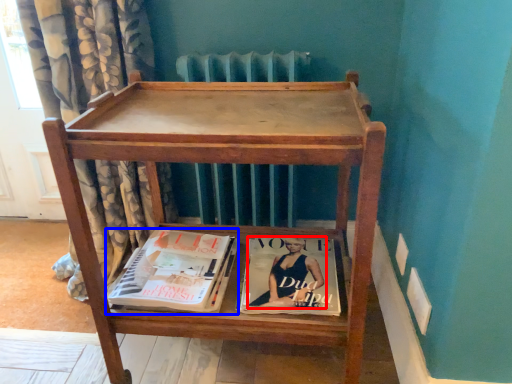
Question: Which point is further to the camera, person (highlighted by a red box) or book (highlighted by a blue box)?

Choices:
 (A) person
 (B) book

Answer: (A)